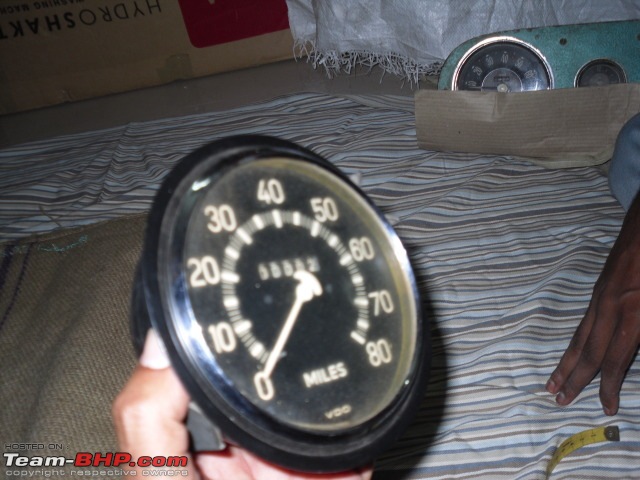
What are the coordinates of `striped cloth` in the screenshot? It's located at (497, 297).